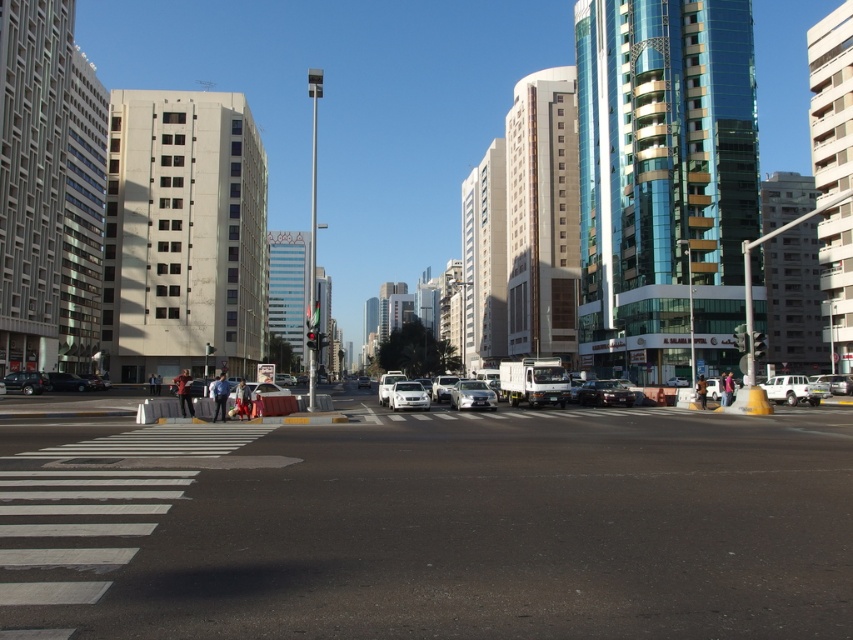
Question: Is white matte car at center to the left of shiny black sedan at lower left from the viewer's perspective?

Choices:
 (A) yes
 (B) no

Answer: (B)

Question: Which of the following is the farthest from the observer?

Choices:
 (A) (329, 429)
 (B) (798, 378)
 (C) (57, 376)

Answer: (C)

Question: Among these objects, which one is nearest to the camera?

Choices:
 (A) white matte suv at lower right
 (B) white matte car at center
 (C) black asphalt road at center
 (D) white glossy car at center

Answer: (C)

Question: Which object is positioned closest to the white matte car at center?

Choices:
 (A) black asphalt road at center
 (B) white matte suv at lower right

Answer: (A)

Question: Does white matte suv at lower right appear over shiny black sedan at center?

Choices:
 (A) yes
 (B) no

Answer: (A)

Question: In this image, where is black asphalt road at center located relative to shiny black sedan at lower left?

Choices:
 (A) above
 (B) below

Answer: (A)